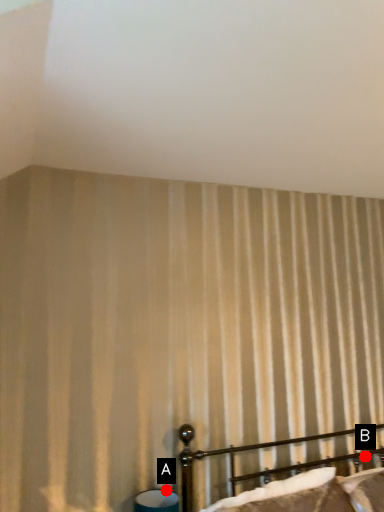
Question: Two points are circled on the image, labeled by A and B beside each circle. Which point is further to the camera?

Choices:
 (A) A is further
 (B) B is further

Answer: (B)